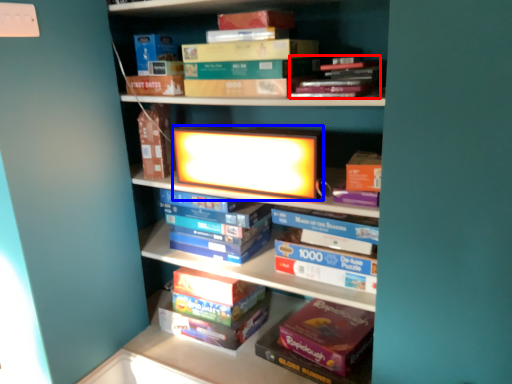
Question: Which object appears farthest to the camera in this image, book (highlighted by a red box) or book cover (highlighted by a blue box)?

Choices:
 (A) book
 (B) book cover

Answer: (B)